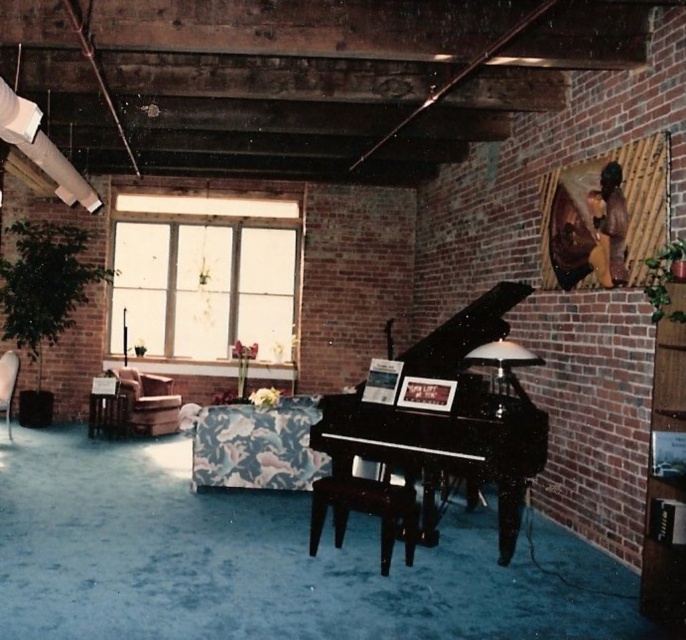
Question: Can you confirm if black polished piano at center is positioned to the right of brown leather armchair at left?

Choices:
 (A) yes
 (B) no

Answer: (A)

Question: Which object is farther from the camera taking this photo?

Choices:
 (A) shiny black stool at center
 (B) brown leather armchair at left

Answer: (B)

Question: Is the position of brown leather armchair at left more distant than that of floral fabric armchair at left?

Choices:
 (A) yes
 (B) no

Answer: (A)

Question: Considering the real-world distances, which object is farthest from the floral fabric armchair at left?

Choices:
 (A) shiny black stool at center
 (B) black polished piano at center
 (C) brown leather armchair at left

Answer: (B)

Question: Which of the following is the farthest from the observer?

Choices:
 (A) shiny black stool at center
 (B) black polished piano at center

Answer: (B)

Question: Does black polished piano at center have a greater width compared to shiny black stool at center?

Choices:
 (A) yes
 (B) no

Answer: (A)